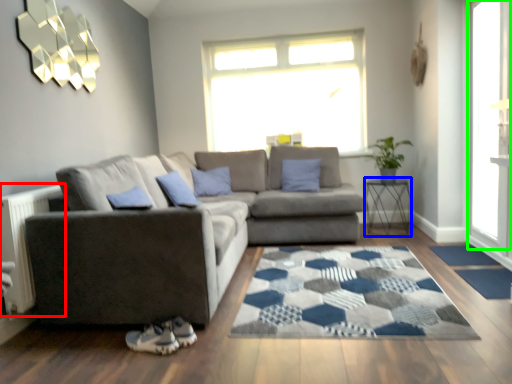
Question: Considering the real-world distances, which object is farthest from radiator (highlighted by a red box)? table (highlighted by a blue box) or glass door (highlighted by a green box)?

Choices:
 (A) table
 (B) glass door

Answer: (A)